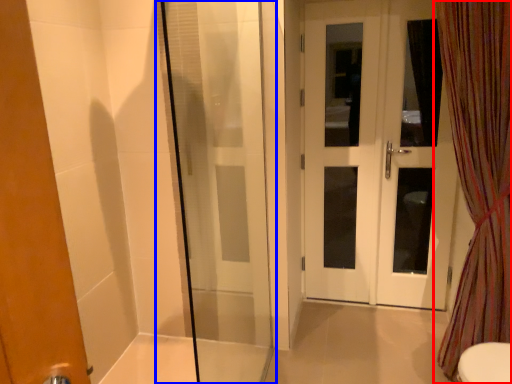
Question: Which object appears closest to the camera in this image, curtain (highlighted by a red box) or shower door (highlighted by a blue box)?

Choices:
 (A) curtain
 (B) shower door

Answer: (B)